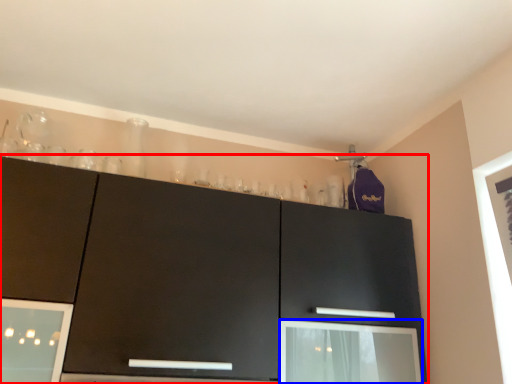
Question: Which point is closer to the camera, cabinetry (highlighted by a red box) or screen door (highlighted by a blue box)?

Choices:
 (A) cabinetry
 (B) screen door

Answer: (A)